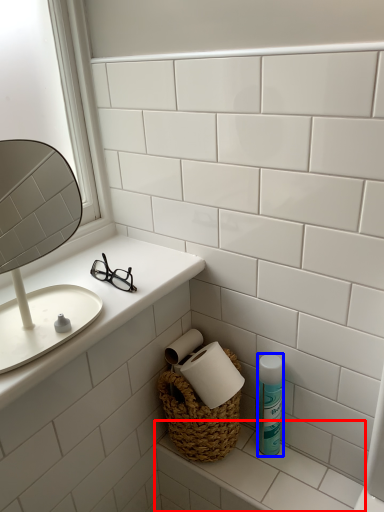
Question: Among these objects, which one is nearest to the camera, counter top (highlighted by a red box) or mouthwash (highlighted by a blue box)?

Choices:
 (A) counter top
 (B) mouthwash

Answer: (A)